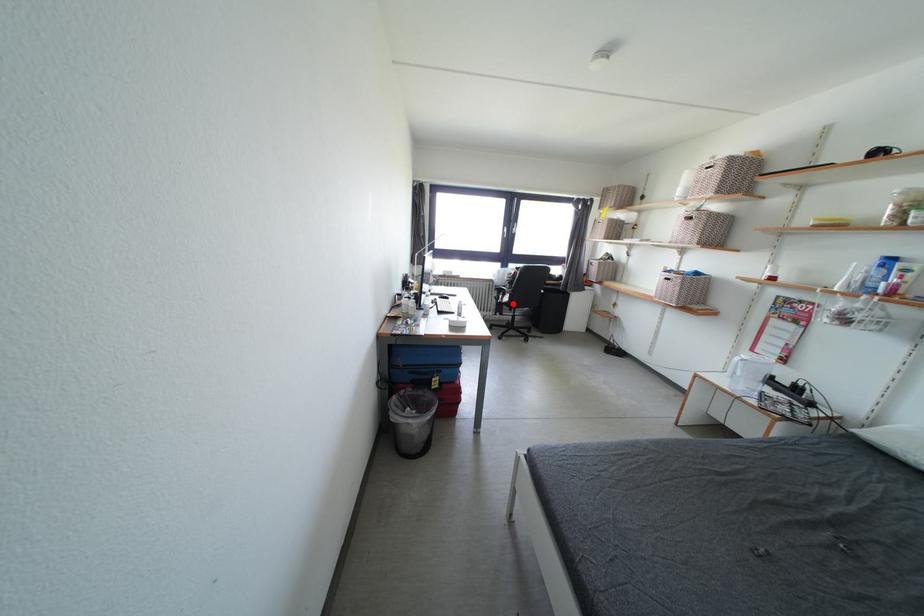
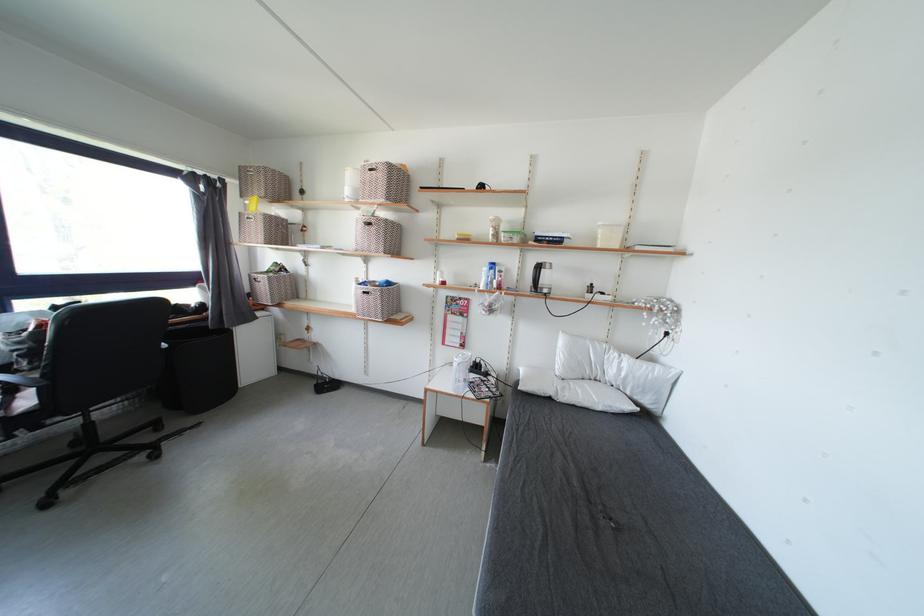
In the second image, find the point that corresponds to the highlighted location in the first image.

(33, 407)